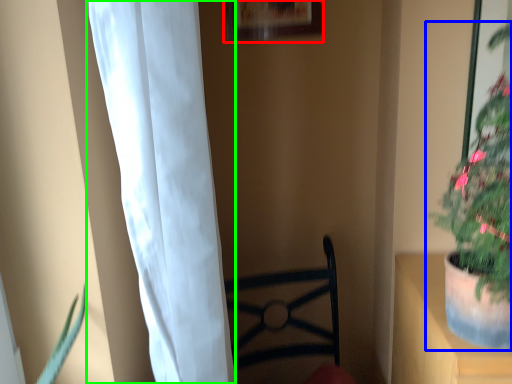
Question: Considering the real-world distances, which object is farthest from picture frame (highlighted by a red box)? houseplant (highlighted by a blue box) or curtain (highlighted by a green box)?

Choices:
 (A) houseplant
 (B) curtain

Answer: (B)